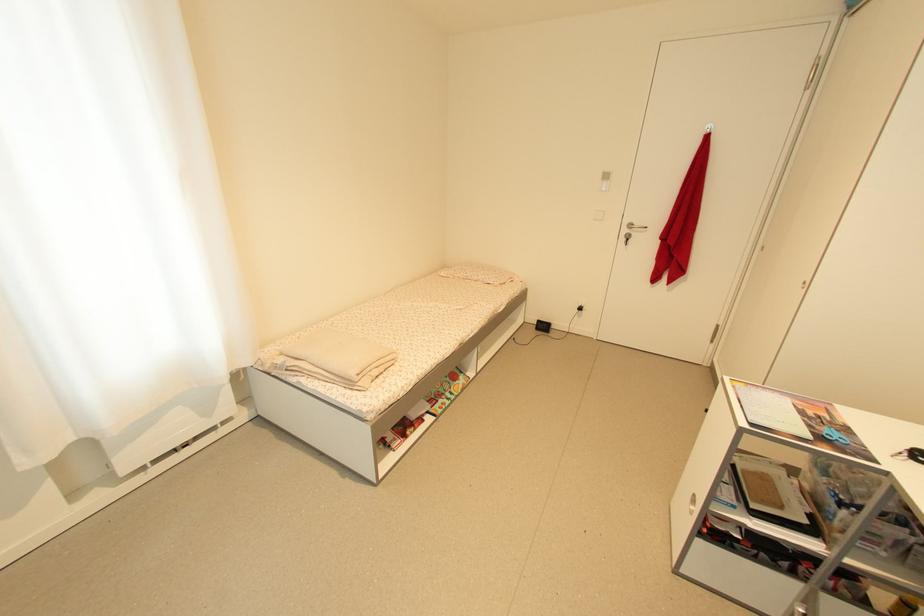
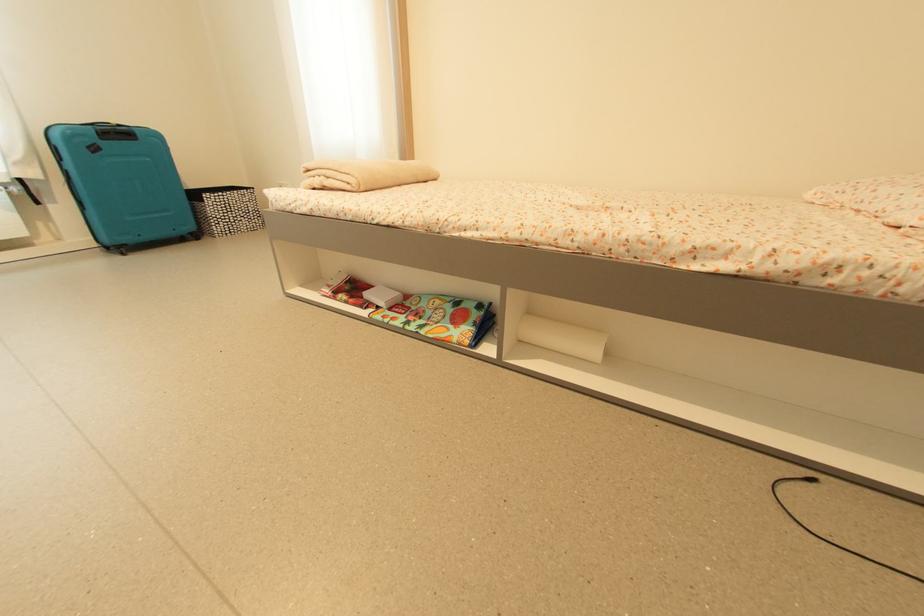
The point at (x=405, y=442) is marked in the first image. Where is the corresponding point in the second image?

(333, 293)